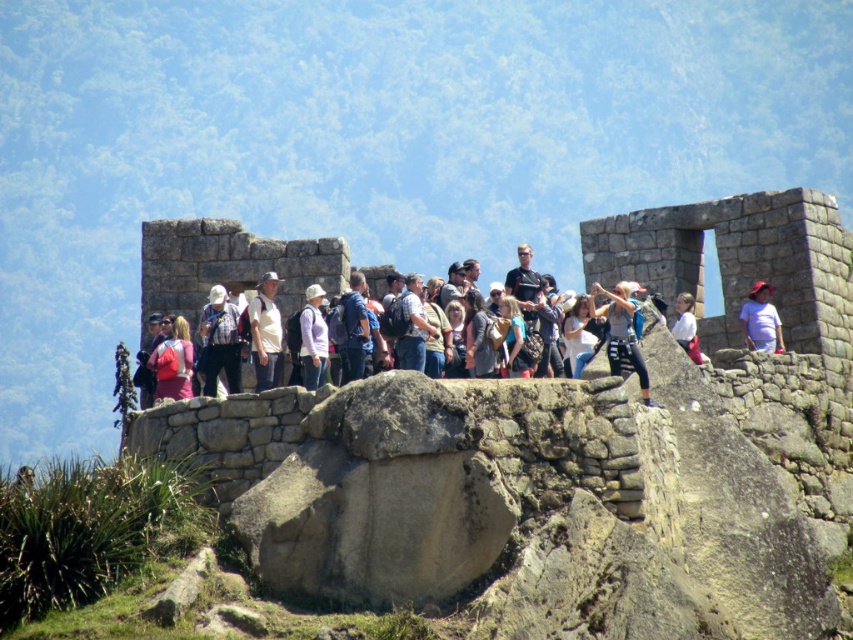
You are a photographer trying to capture a photo of the denim jeans at center and the white cotton shirt at center. Which object should you focus on first if you want to ensure both are in focus without adjusting your camera settings?

The denim jeans at center is much taller than the white cotton shirt at center. Since the taller object is further away, you should focus on the denim jeans at center first to ensure depth of field covers both subjects.

You are standing at the center of the stone structure and want to place a new flag at the exact center of the platform. The platform is a rectangle. Where should you place the flag relative to the matte red backpack at center?

The flag should be placed at the center of the rectangular platform. Since the matte red backpack at center is already at point (173, 362), you need to adjust its position to the true center coordinates of the platform, which would be the midpoint of the rectangle.

You are standing at the base of the ancient Incan stone structure and want to take a photo of the two points mentioned. Which point, point (575,365) or point (688,307), would appear larger in your photo?

Point (575,365) appears larger in the photo because it is closer to the viewer than point (688,307).